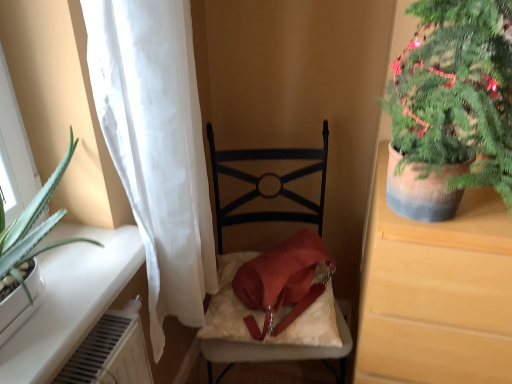
From the picture: Measure the distance between point [444,320] and camera.

Point [444,320] is 1.01 meters from camera.

Image resolution: width=512 pixels, height=384 pixels. Find the location of `white sheer curtain at left`. white sheer curtain at left is located at coordinates (156, 146).

What do you see at coordinates (265, 176) in the screenshot?
I see `matte black chair at center` at bounding box center [265, 176].

Find the location of a particular element. The width and height of the screenshot is (512, 384). matte black chair at center is located at coordinates (265, 176).

You are a GUI agent. You are given a task and a screenshot of the screen. Output one action in this format:
    pyautogui.click(x=<x>, y=<y>)
    Task: Click on the matte brown cabinet at right
    The image size is (512, 384).
    Given the screenshot: What is the action you would take?
    pyautogui.click(x=437, y=294)

Does matte black chair at center have a larger size compared to white sheer curtain at left?

Yes, matte black chair at center is bigger than white sheer curtain at left.

Is point (324, 141) positioned after point (188, 94)?

Yes, it is behind point (188, 94).

Does matte black chair at center appear on the right side of white sheer curtain at left?

Indeed, matte black chair at center is positioned on the right side of white sheer curtain at left.

Would you say green textured plant at upper right contains matte black chair at center?

No, matte black chair at center is not surrounded by green textured plant at upper right.

Measure the distance between green textured plant at upper right and matte black chair at center.

green textured plant at upper right and matte black chair at center are 79.76 centimeters apart.

Considering the sizes of objects green textured plant at upper right and matte black chair at center in the image provided, who is smaller, green textured plant at upper right or matte black chair at center?

green textured plant at upper right.

From a real-world perspective, is green textured plant at upper right positioned above or below matte black chair at center?

In terms of real-world spatial position, green textured plant at upper right is above matte black chair at center.

Does white sheer curtain at left appear on the left side of green textured plant at upper right?

Correct, you'll find white sheer curtain at left to the left of green textured plant at upper right.

In the scene shown: Does white sheer curtain at left turn towards green textured plant at upper right?

Yes.

Can you confirm if white sheer curtain at left is bigger than matte black chair at center?

Incorrect, white sheer curtain at left is not larger than matte black chair at center.

Does point (159, 324) appear closer or farther from the camera than point (242, 200)?

Point (159, 324) appears to be closer to the viewer than point (242, 200).

Is white sheer curtain at left far from matte black chair at center?

white sheer curtain at left is near matte black chair at center, not far away.

Which is behind, white sheer curtain at left or matte black chair at center?

matte black chair at center is further away from the camera.

Which is behind, matte black chair at center or matte brown cabinet at right?

matte black chair at center is behind.

The height and width of the screenshot is (384, 512). Find the location of `chair located on the left of matte brown cabinet at right`. chair located on the left of matte brown cabinet at right is located at coordinates (265, 176).

Does matte black chair at center have a larger size compared to matte brown cabinet at right?

No.

In the scene shown: Considering the relative sizes of matte black chair at center and matte brown cabinet at right in the image provided, is matte black chair at center taller than matte brown cabinet at right?

Indeed, matte black chair at center has a greater height compared to matte brown cabinet at right.

Which is nearer, (x=483, y=245) or (x=217, y=188)?

Point (x=483, y=245).

Based on their positions, is matte brown cabinet at right located to the left or right of matte black chair at center?

matte brown cabinet at right is positioned on matte black chair at center's right side.

What's the angular difference between matte brown cabinet at right and matte black chair at center's facing directions?

The angle between the facing direction of matte brown cabinet at right and the facing direction of matte black chair at center is 15.8 degrees.

Considering the relative sizes of matte brown cabinet at right and green textured plant at upper right in the image provided, is matte brown cabinet at right thinner than green textured plant at upper right?

Incorrect, the width of matte brown cabinet at right is not less than that of green textured plant at upper right.

Locate an element on the screen. The image size is (512, 384). cabinetry that is on the right side of green textured plant at upper right is located at coordinates (437, 294).

Which object is positioned more to the left, matte brown cabinet at right or green textured plant at upper right?

green textured plant at upper right.

What's the angular difference between matte brown cabinet at right and green textured plant at upper right's facing directions?

0.000703 degrees separate the facing orientations of matte brown cabinet at right and green textured plant at upper right.

Find the location of a particular element. The image size is (512, 384). curtain located on the left of matte black chair at center is located at coordinates (156, 146).

Where is `chair behind the green textured plant at upper right`? chair behind the green textured plant at upper right is located at coordinates (265, 176).

Which object lies further to the anchor point matte black chair at center, velvet-like white pillow at center or matte brown cabinet at right?

matte brown cabinet at right is positioned further to the anchor matte black chair at center.

Consider the image. From the image, which object appears to be nearer to velvet-like white pillow at center, matte black chair at center or green textured plant at upper right?

matte black chair at center lies closer to velvet-like white pillow at center than the other object.

In the scene shown: Considering their positions, is velvet-like white pillow at center positioned further to matte black chair at center than white sheer curtain at left?

Based on the image, white sheer curtain at left appears to be further to matte black chair at center.

Which object lies further to the anchor point velvet-like white pillow at center, matte brown cabinet at right or matte black chair at center?

Among the two, matte brown cabinet at right is located further to velvet-like white pillow at center.

Based on the photo, based on their spatial positions, is matte black chair at center or white sheer curtain at left closer to velvet-like white pillow at center?

Based on the image, matte black chair at center appears to be nearer to velvet-like white pillow at center.

Which object lies nearer to the anchor point white sheer curtain at left, green textured plant at upper right or matte brown cabinet at right?

green textured plant at upper right.

Estimate the real-world distances between objects in this image. Which object is further from matte brown cabinet at right, velvet-like white pillow at center or matte black chair at center?

The object further to matte brown cabinet at right is matte black chair at center.

Consider the image. When comparing their distances from white sheer curtain at left, does velvet-like white pillow at center or green textured plant at upper right seem closer?

The object closer to white sheer curtain at left is velvet-like white pillow at center.

At what (x,y) coordinates should I click in order to perform the action: click on houseplant between white sheer curtain at left and matte brown cabinet at right in the horizontal direction. Please return your answer as a coordinate pair (x, y). This screenshot has width=512, height=384. Looking at the image, I should click on (451, 107).

Where is `houseplant between matte black chair at center and matte brown cabinet at right from left to right`? This screenshot has width=512, height=384. houseplant between matte black chair at center and matte brown cabinet at right from left to right is located at coordinates (451, 107).

Find the location of a particular element. chair between white sheer curtain at left and velvet-like white pillow at center along the z-axis is located at coordinates (265, 176).

Locate an element on the screen. chair located between white sheer curtain at left and green textured plant at upper right in the left-right direction is located at coordinates (265, 176).